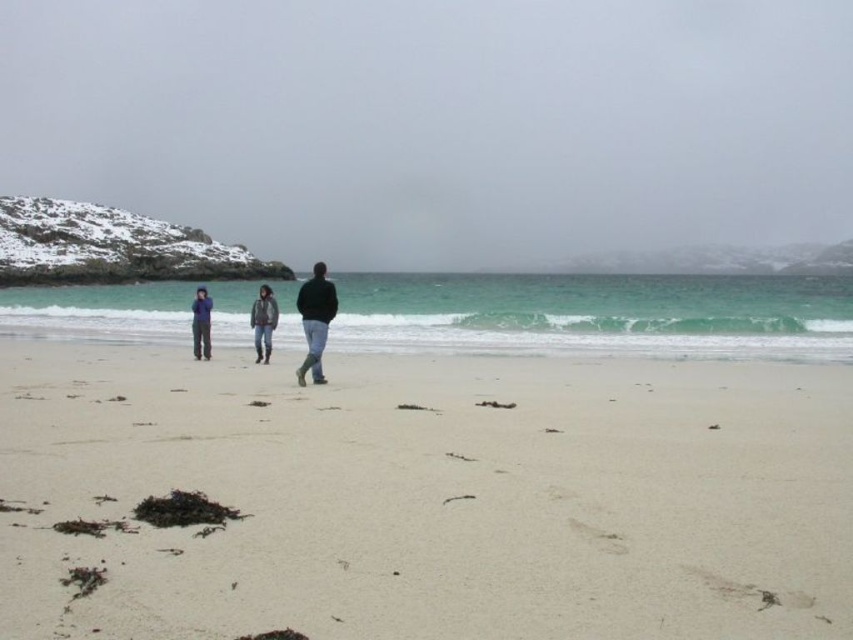
You are standing on the beach and want to place a small seashell on the smooth sand at center. Can you see the seashell from a distance of 10 meters away if you are looking towards the blue fleece jacket at center?

The smooth sand at center has a lesser height compared to blue fleece jacket at center. Since the sand is lower, the seashell placed on it might be partially obscured by the jacket, making it harder to see from 10 meters away.

You are a photographer trying to capture the blue fleece jacket at center in your shot. The smooth sand at center is blocking your view. Can you adjust your position to see the jacket without moving it?

The smooth sand at center is below the blue fleece jacket at center, so you can lower your camera angle to see the jacket above the sand without moving it.

You are a beachcomber searching for hidden treasures on the beach. You notice both smooth sand at center and white sand at center. Which one is located lower in the scene?

The smooth sand at center is located lower than the white sand at center.